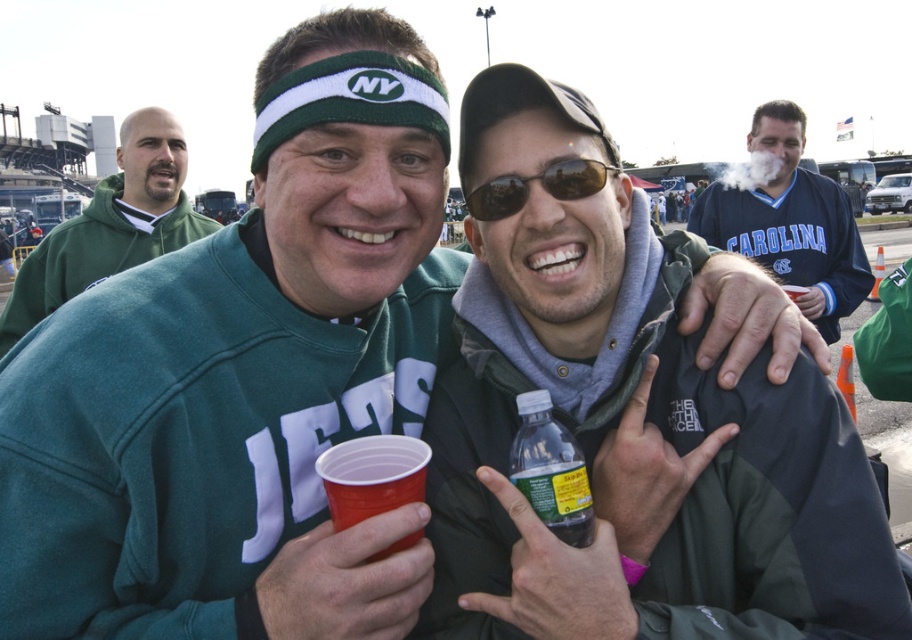
From the picture: Does green fleece sweatshirt at upper left appear on the left side of sunglasses at center?

Yes, green fleece sweatshirt at upper left is to the left of sunglasses at center.

Is green fleece sweatshirt at upper left shorter than sunglasses at center?

In fact, green fleece sweatshirt at upper left may be taller than sunglasses at center.

You are a GUI agent. You are given a task and a screenshot of the screen. Output one action in this format:
    pyautogui.click(x=<x>, y=<y>)
    Task: Click on the green fleece sweatshirt at upper left
    
    Given the screenshot: What is the action you would take?
    pyautogui.click(x=111, y=225)

Is translucent plastic bottle at center positioned in front of blue jersey at upper right?

That is True.

Which is in front, point (537, 620) or point (816, 205)?

Point (537, 620) is in front.

Does point (879, 625) lie behind point (786, 140)?

No, it is not.

Locate an element on the screen. The image size is (912, 640). translucent plastic bottle at center is located at coordinates (659, 435).

Which is more to the right, clear plastic bottle at center or sunglasses at center?

clear plastic bottle at center is more to the right.

Is clear plastic bottle at center to the right of sunglasses at center from the viewer's perspective?

Correct, you'll find clear plastic bottle at center to the right of sunglasses at center.

I want to click on clear plastic bottle at center, so click(x=551, y=470).